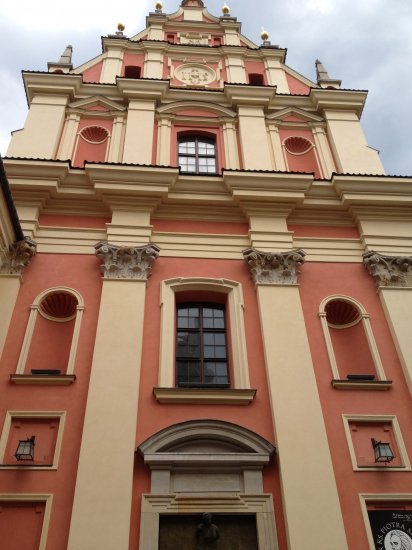
At what (x,y) coordinates should I click in order to perform the action: click on door. Please return your answer as a coordinate pair (x, y). This screenshot has width=412, height=550. Looking at the image, I should click on (191, 538), (227, 531).